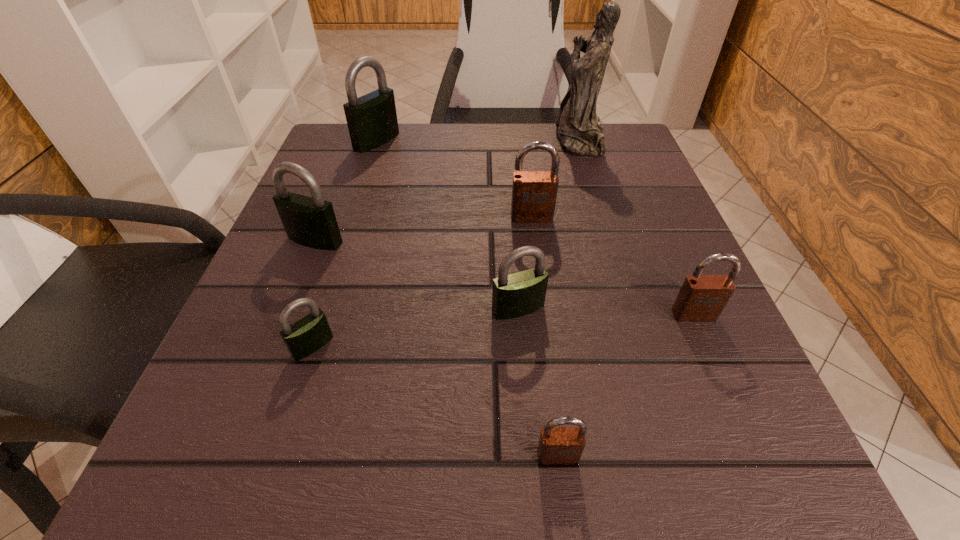
Where is `the tallest object`? The width and height of the screenshot is (960, 540). the tallest object is located at coordinates (579, 130).

Find the location of a particular element. figurine is located at coordinates click(579, 130).

At what (x,y) coordinates should I click in order to perform the action: click on the tallest padlock. Please return your answer as a coordinate pair (x, y). Image resolution: width=960 pixels, height=540 pixels. Looking at the image, I should click on (372, 121).

This screenshot has height=540, width=960. In order to click on the second tallest object in this screenshot , I will do `click(372, 121)`.

What are the coordinates of `the fourth farthest object` in the screenshot? It's located at (310, 221).

This screenshot has width=960, height=540. What are the coordinates of `the third smallest black padlock` in the screenshot? It's located at (310, 221).

Identify the location of the sixth nearest object. (534, 193).

The height and width of the screenshot is (540, 960). I want to click on the second farthest padlock, so click(534, 193).

Find the location of a particular element. The height and width of the screenshot is (540, 960). the second biggest brown padlock is located at coordinates (702, 297).

You are a GUI agent. You are given a task and a screenshot of the screen. Output one action in this format:
    pyautogui.click(x=<x>, y=<y>)
    Task: Click on the second farthest brown padlock
    
    Given the screenshot: What is the action you would take?
    pyautogui.click(x=702, y=297)